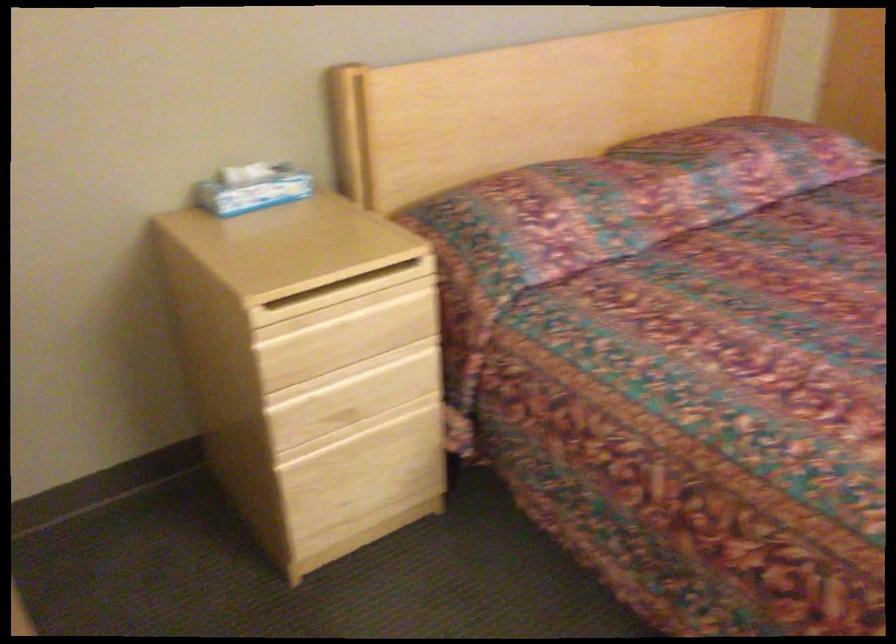
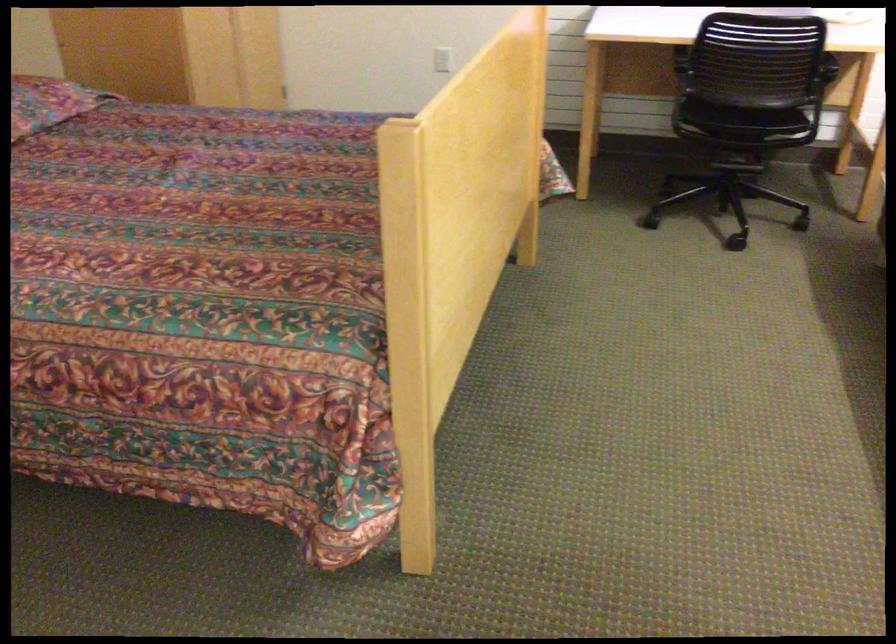
The point at (820, 156) is marked in the first image. Where is the corresponding point in the second image?

(48, 102)